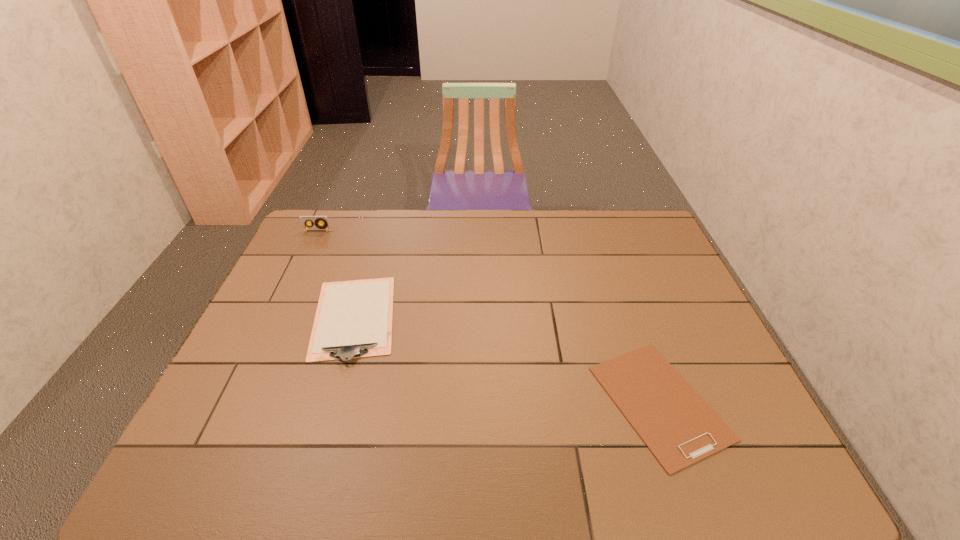
Find the location of a particular element. Image resolution: width=960 pixels, height=540 pixels. object located at the near edge is located at coordinates (676, 424).

What are the coordinates of `videotape that is at the left edge` in the screenshot? It's located at (325, 225).

Where is `clipboard located in the left edge section of the desktop`? The height and width of the screenshot is (540, 960). clipboard located in the left edge section of the desktop is located at coordinates (353, 319).

I want to click on object located at the right edge, so click(676, 424).

Identify the location of object situated at the far left corner. This screenshot has width=960, height=540. (325, 225).

Image resolution: width=960 pixels, height=540 pixels. What are the coordinates of `object located in the near right corner section of the desktop` in the screenshot? It's located at (676, 424).

In the image, there is a desktop. Identify the location of vacant area at the far edge. (531, 232).

In the image, there is a desktop. Where is `vacant space at the near edge`? This screenshot has height=540, width=960. vacant space at the near edge is located at coordinates (256, 474).

The width and height of the screenshot is (960, 540). Identify the location of free space at the left edge of the desktop. (259, 439).

The height and width of the screenshot is (540, 960). In order to click on vacant space at the right edge of the desktop in this screenshot , I will do `click(666, 310)`.